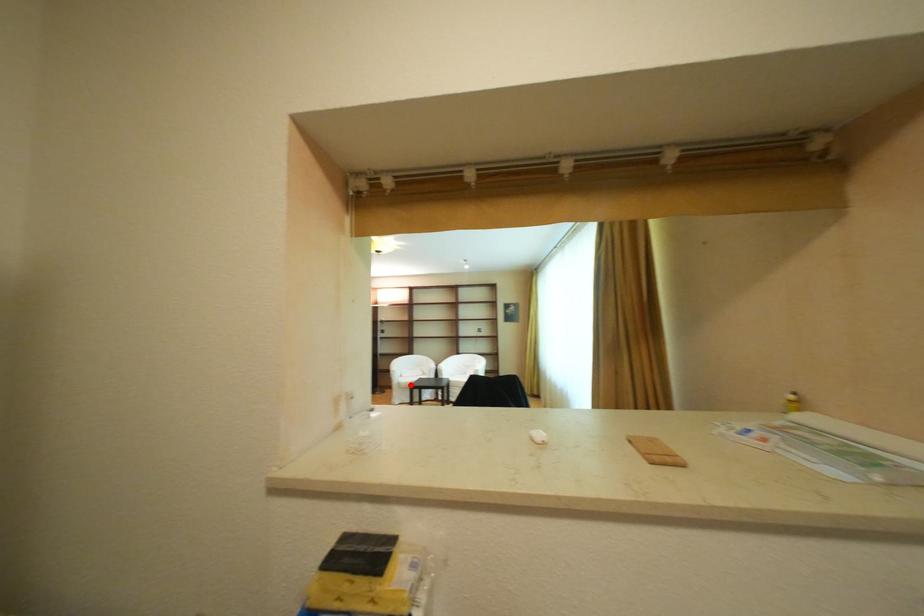
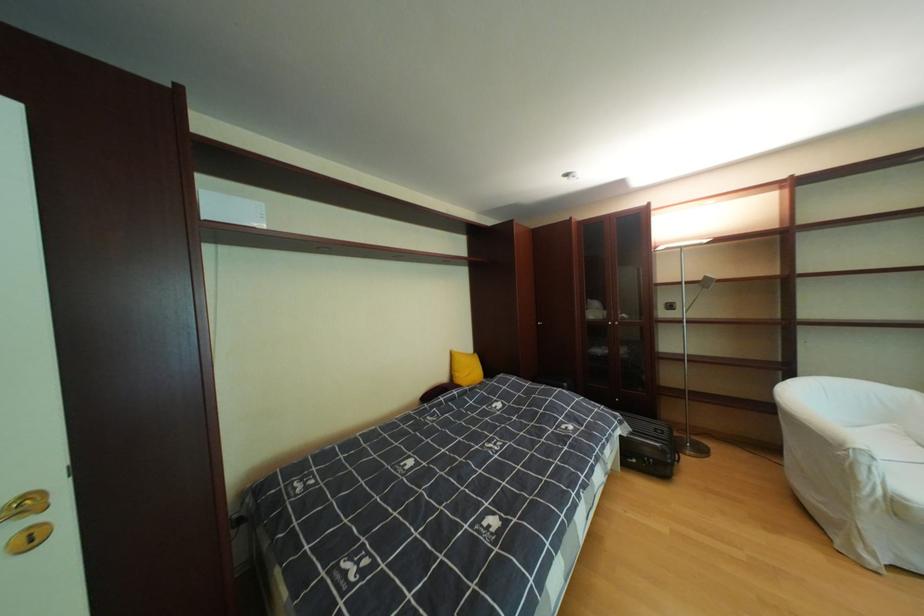
Question: A red point is marked in image1. In image2, is the corresponding 3D point closer to the camera or farther? Reply with the corresponding letter.

Choices:
 (A) The corresponding 3D point is closer.
 (B) The corresponding 3D point is farther.

Answer: (A)